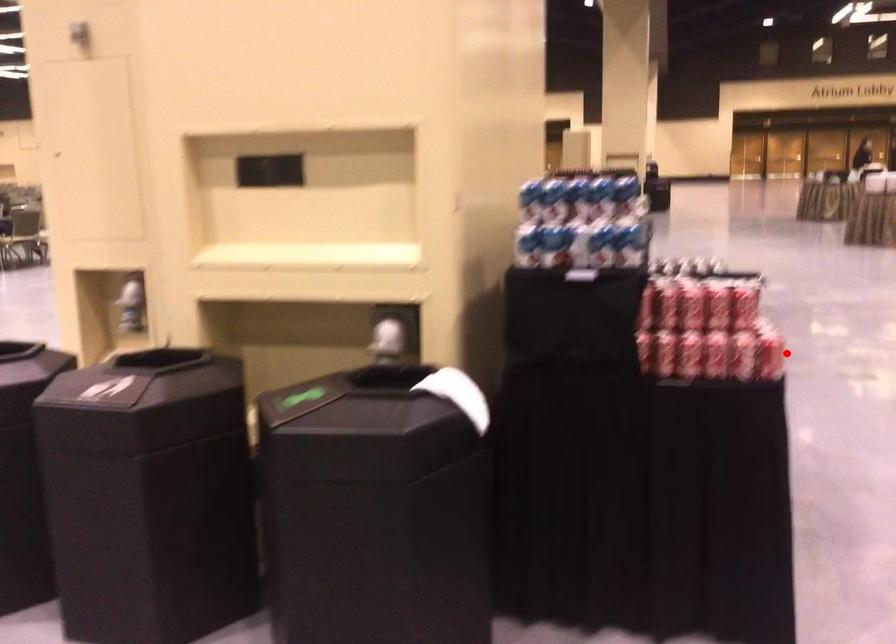
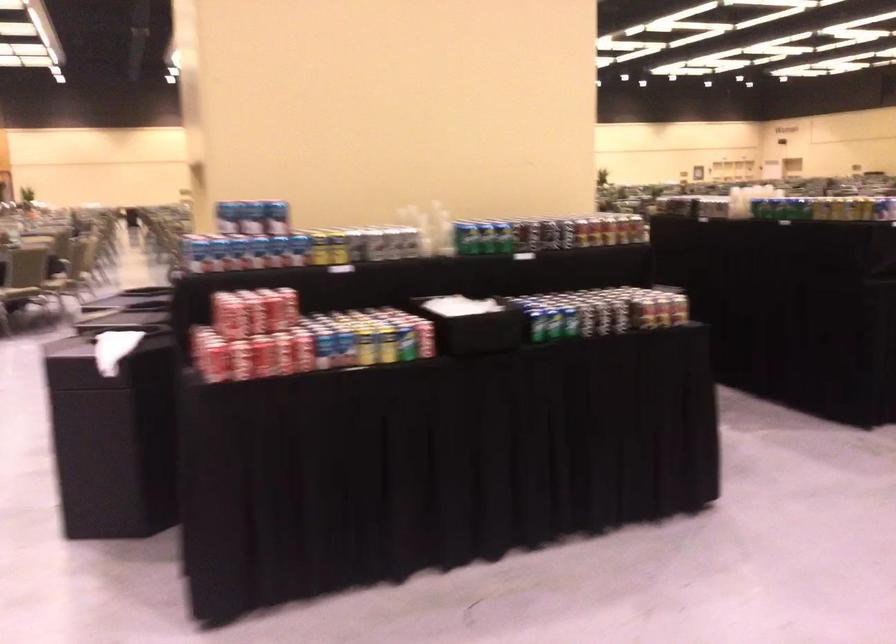
Question: I am providing you with two images of the same scene from different viewpoints. Given a red point in image1, look at the same physical point in image2. Is it:

Choices:
 (A) Closer to the viewpoint
 (B) Farther from the viewpoint

Answer: (B)